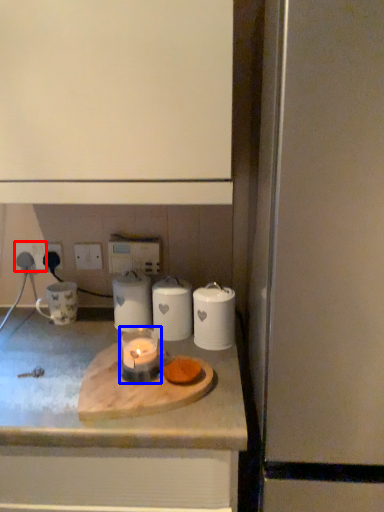
Question: Which point is further to the camera, electric outlet (highlighted by a red box) or candle holder (highlighted by a blue box)?

Choices:
 (A) electric outlet
 (B) candle holder

Answer: (A)